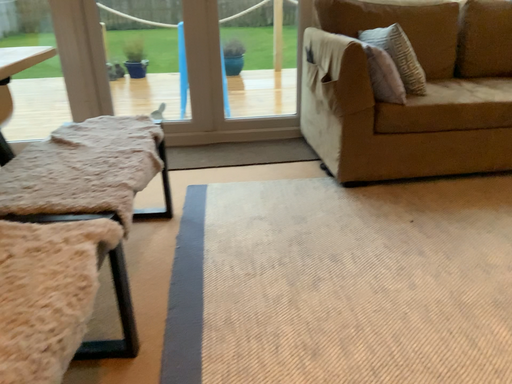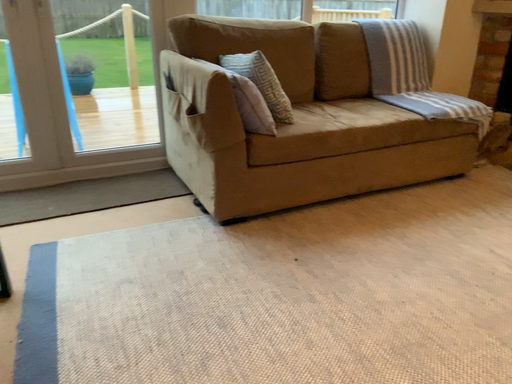
Question: How did the camera likely rotate when shooting the video?

Choices:
 (A) rotated right
 (B) rotated left

Answer: (A)